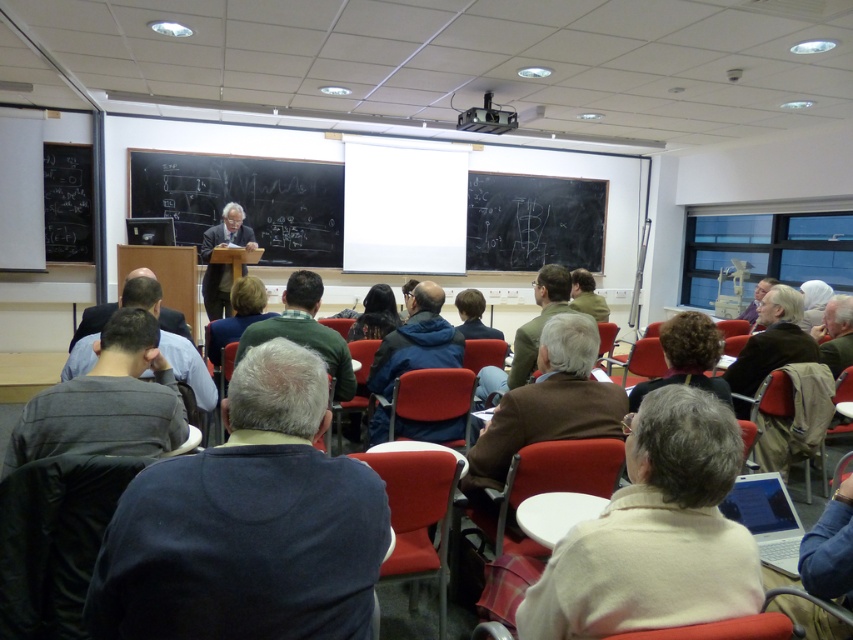
Question: Considering the real-world distances, which object is closest to the dark suit at center?

Choices:
 (A) dark gray suit at center
 (B) blue fabric jacket at center
 (C) dark brown hair at center
 (D) dark gray fabric shirt at lower left

Answer: (A)

Question: From the image, what is the correct spatial relationship of dark brown leather jacket at center in relation to curly hair at center?

Choices:
 (A) right
 (B) left

Answer: (A)

Question: Which point is farther to the camera?

Choices:
 (A) (412, 340)
 (B) (107, 308)

Answer: (B)

Question: Can you confirm if blue fabric jacket at center is wider than dark suit at center?

Choices:
 (A) no
 (B) yes

Answer: (A)

Question: Which of the following is the closest to the observer?

Choices:
 (A) dark blue shirt at lower left
 (B) dark gray fabric shirt at lower left
 (C) green matte sweater at center
 (D) dark brown leather jacket at center

Answer: (B)

Question: Can you confirm if dark blue sweater at center is positioned to the left of dark brown leather jacket at center?

Choices:
 (A) no
 (B) yes

Answer: (B)